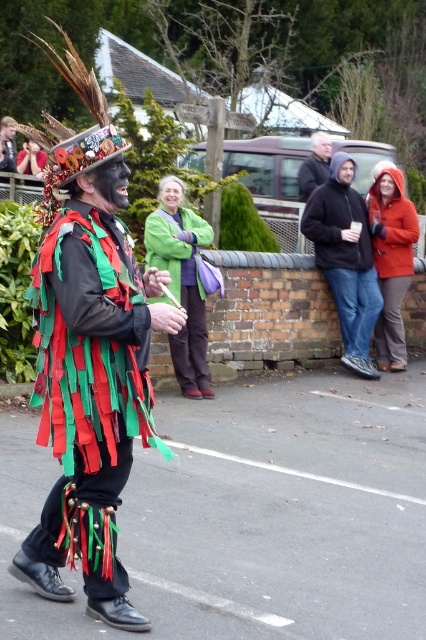
Question: Does orange fuzzy coat at right have a greater width compared to dark blue jacket at center?

Choices:
 (A) yes
 (B) no

Answer: (A)

Question: Which point appears farthest from the camera in this image?

Choices:
 (A) (92, 358)
 (B) (207, 378)

Answer: (B)

Question: Is felt/tissue vest at center to the left of orange fuzzy coat at right from the viewer's perspective?

Choices:
 (A) yes
 (B) no

Answer: (A)

Question: Estimate the real-world distances between objects in this image. Which object is closer to the black hoodie at center?

Choices:
 (A) green fabric bag at center
 (B) dark blue jacket at center
 (C) felt/tissue vest at center
 (D) orange fuzzy coat at right

Answer: (D)

Question: Based on their relative distances, which object is farther from the black hoodie at center?

Choices:
 (A) dark blue jacket at center
 (B) felt/tissue vest at center

Answer: (B)

Question: Does black hoodie at center come behind dark blue jacket at center?

Choices:
 (A) no
 (B) yes

Answer: (A)